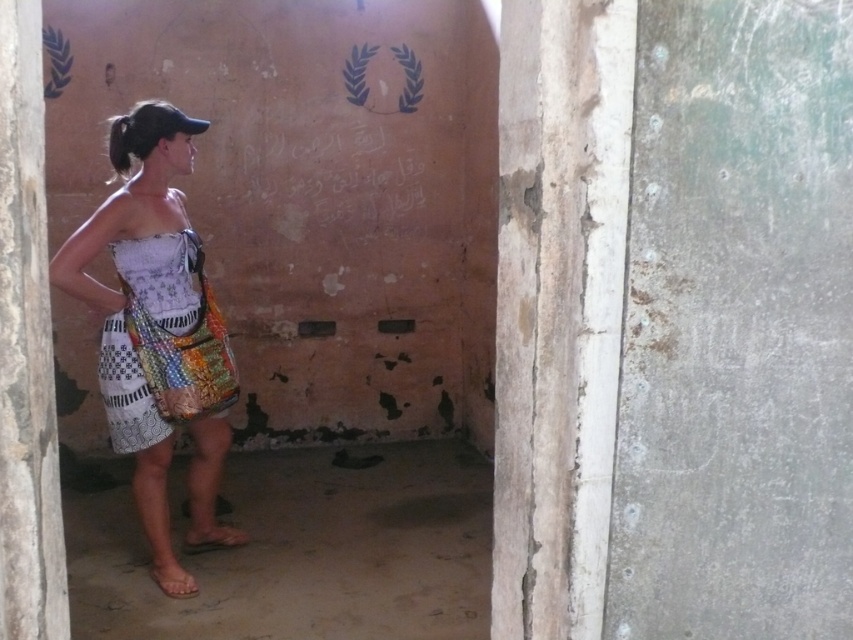
Question: Which point is closer to the camera taking this photo?

Choices:
 (A) (160, 275)
 (B) (206, 394)

Answer: (A)

Question: Is bright multicolored fabric bag at left to the right of brown leather sandal at lower left from the viewer's perspective?

Choices:
 (A) no
 (B) yes

Answer: (A)

Question: Among these points, which one is farthest from the camera?

Choices:
 (A) (186, 536)
 (B) (163, 586)
 (C) (224, 451)
 (D) (146, 273)

Answer: (A)

Question: Can you confirm if white patchwork dress at center is positioned above bright multicolored fabric bag at left?

Choices:
 (A) yes
 (B) no

Answer: (B)

Question: Does white patchwork dress at center come in front of bright multicolored fabric bag at left?

Choices:
 (A) no
 (B) yes

Answer: (B)

Question: Among these objects, which one is farthest from the camera?

Choices:
 (A) brown leather sandal at lower left
 (B) white patchwork dress at center
 (C) brown fabric sandal at lower left
 (D) bright multicolored fabric bag at left

Answer: (A)